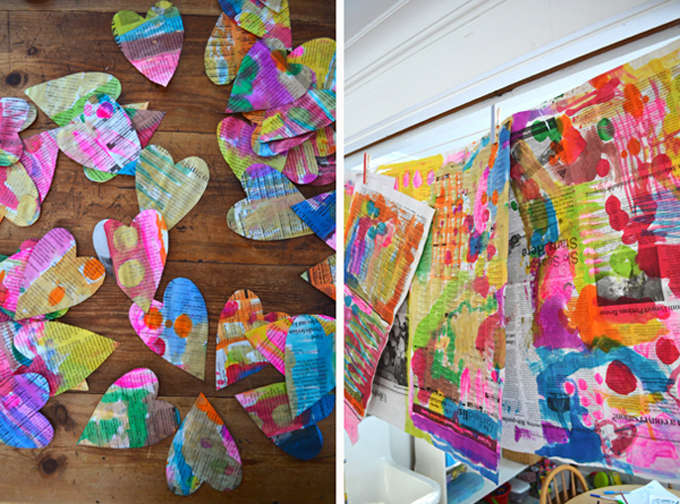
Locate an element on the screen. This screenshot has width=680, height=504. pen is located at coordinates (612, 490).